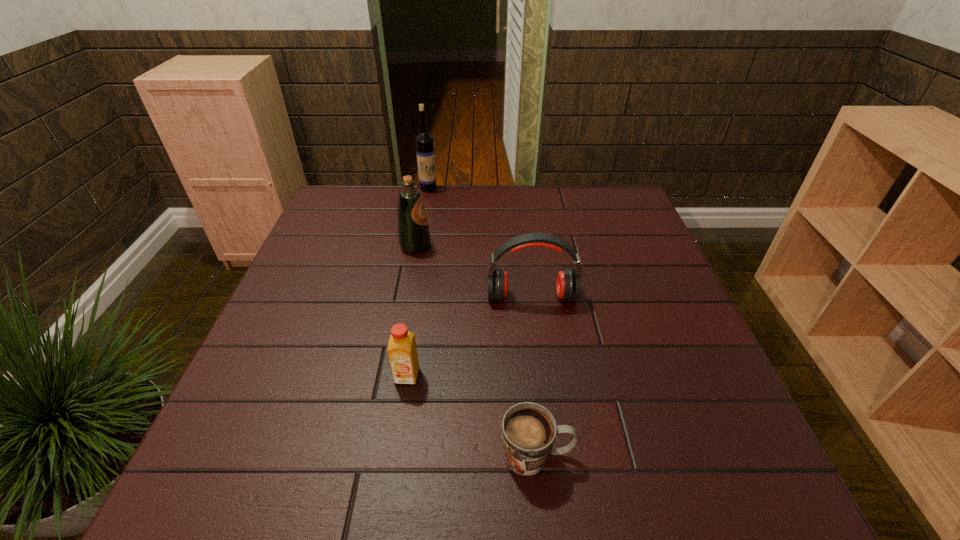
What are the coordinates of `the farthest object` in the screenshot? It's located at (425, 152).

At what (x,y) coordinates should I click in order to perform the action: click on wine bottle. Please return your answer as a coordinate pair (x, y). This screenshot has width=960, height=540. Looking at the image, I should click on (425, 152).

Where is `the second tallest object`? the second tallest object is located at coordinates (414, 237).

Image resolution: width=960 pixels, height=540 pixels. What are the coordinates of `olive oil` in the screenshot? It's located at (414, 237).

At what (x,y) coordinates should I click in order to perform the action: click on earphone. Please return your answer as a coordinate pair (x, y). Looking at the image, I should click on (568, 284).

Locate an element on the screen. The height and width of the screenshot is (540, 960). the third nearest object is located at coordinates (568, 284).

At what (x,y) coordinates should I click in order to perform the action: click on orange juice. Please return your answer as a coordinate pair (x, y). Looking at the image, I should click on (402, 351).

Where is `the fourth farthest object`? the fourth farthest object is located at coordinates (402, 351).

Where is `the shortest object`? The image size is (960, 540). the shortest object is located at coordinates (528, 429).

Where is `the nearest object`? The width and height of the screenshot is (960, 540). the nearest object is located at coordinates pos(528,429).